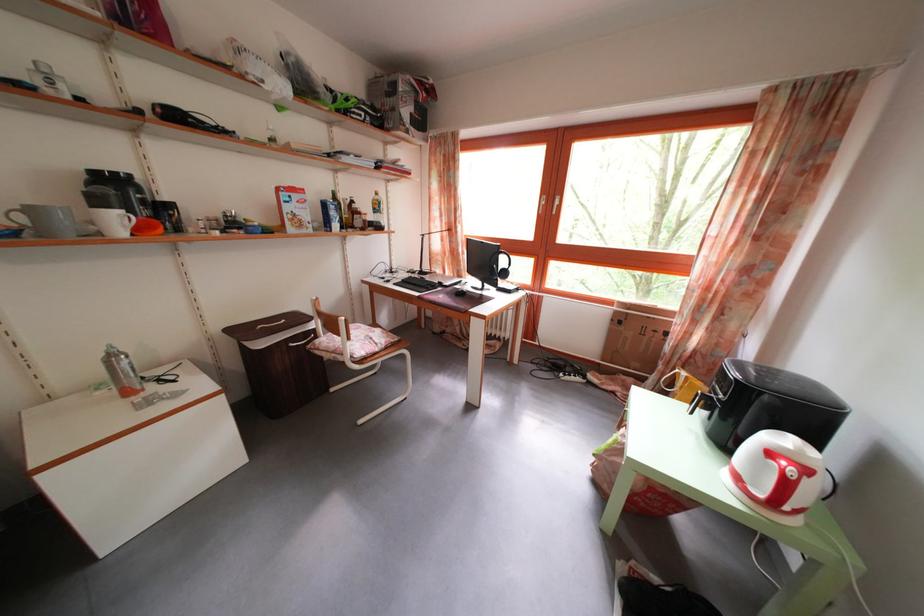
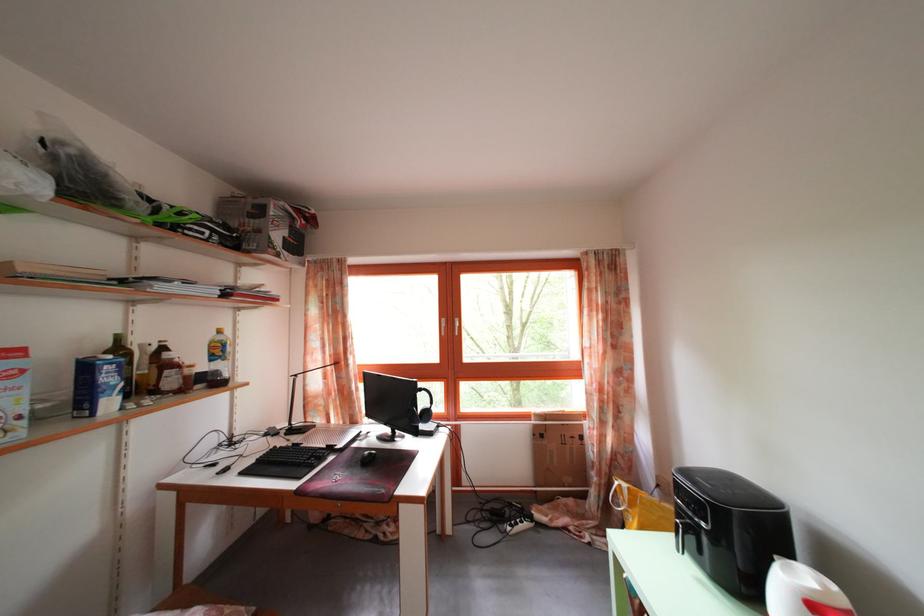
In the second image, find the point that corresponds to point 465,294 in the first image.

(363, 451)